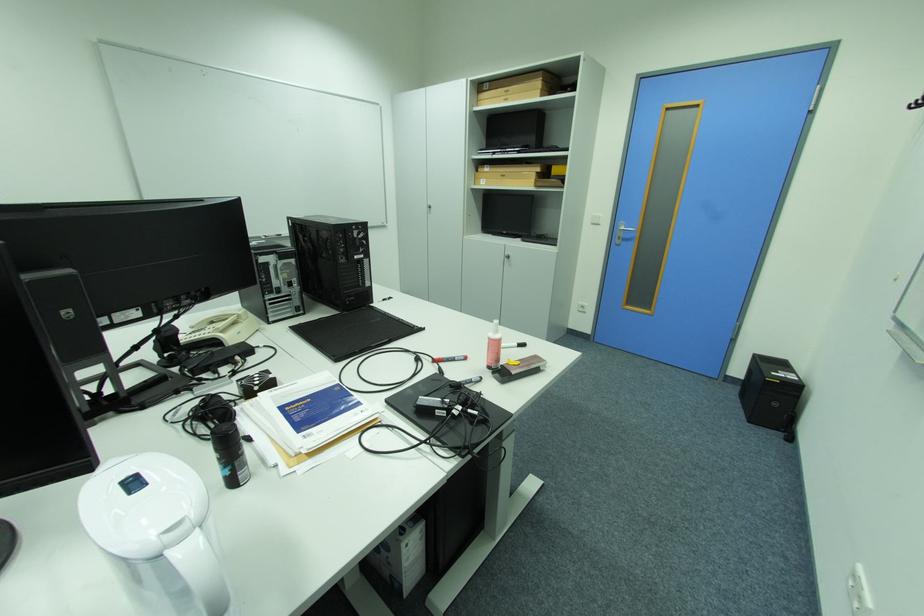
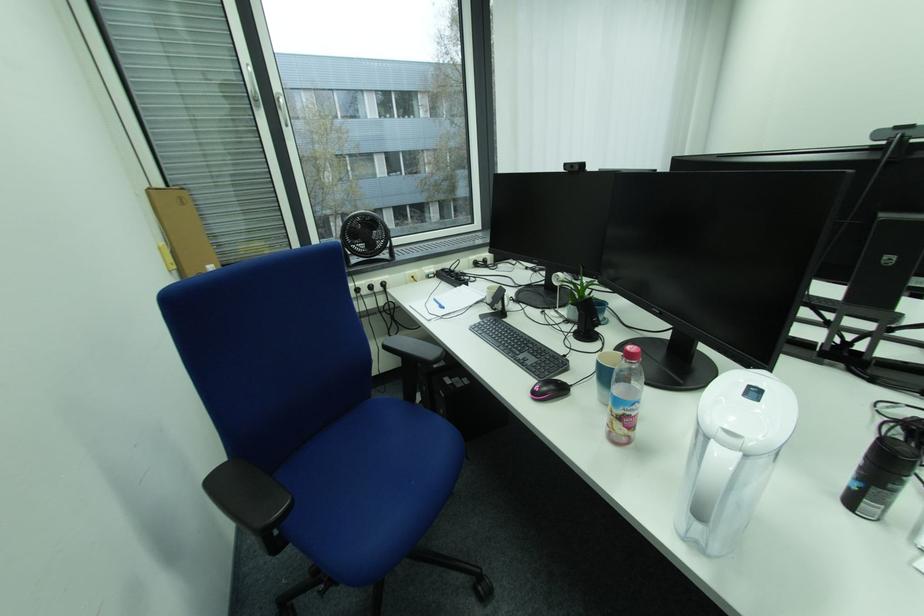
Locate, in the second image, the point that corresponds to pixel 247 477 in the first image.

(870, 506)